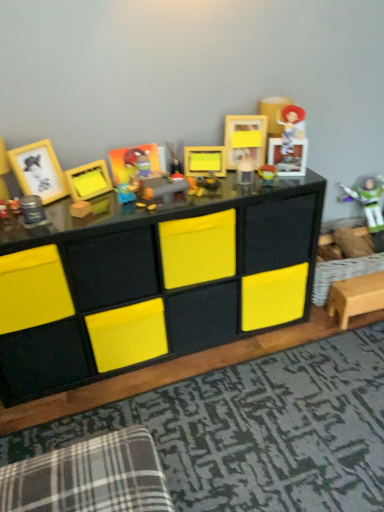
The image size is (384, 512). In order to click on free location in front of yellow matte picture frame at center, the 4th picture frame from the left in this screenshot , I will do `click(219, 187)`.